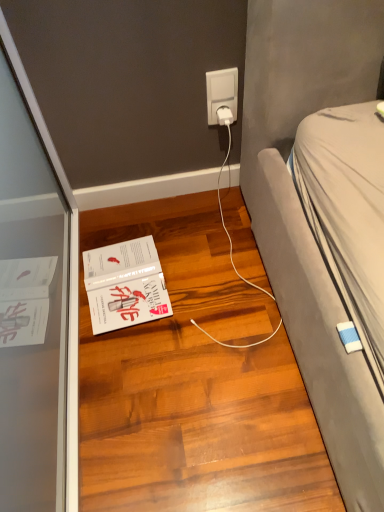
The width and height of the screenshot is (384, 512). What do you see at coordinates (222, 96) in the screenshot? I see `white plastic power plug at upper center` at bounding box center [222, 96].

Find the location of a particular element. white plastic power plug at upper center is located at coordinates (222, 96).

What are the coordinates of `white plastic power plug at upper center` in the screenshot? It's located at [222, 96].